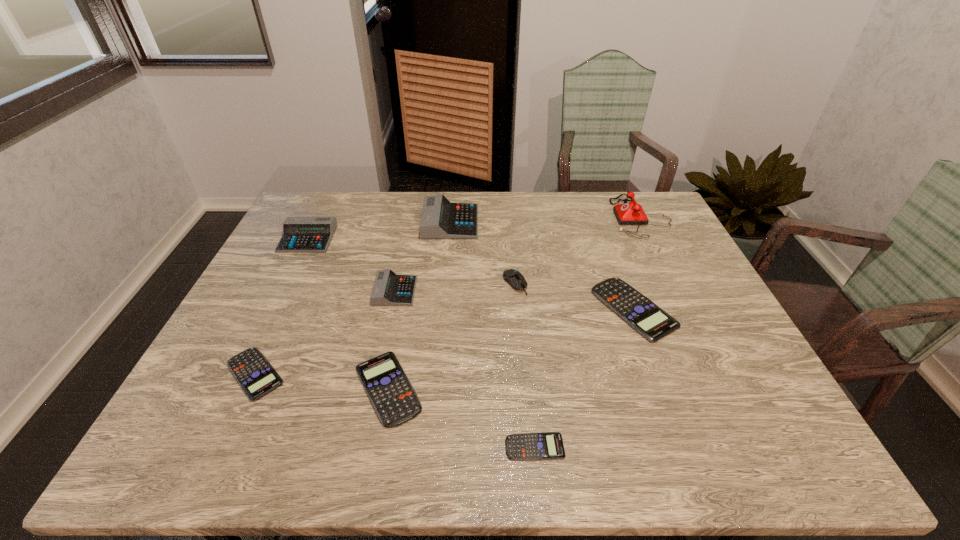
Find the location of `blank area located on the front of the biggest gray calculator`. blank area located on the front of the biggest gray calculator is located at coordinates (443, 308).

Find the location of a particular element. The height and width of the screenshot is (540, 960). vacant space located 0.120m on the back of the leftmost gray calculator is located at coordinates (324, 206).

You are a GUI agent. You are given a task and a screenshot of the screen. Output one action in this format:
    pyautogui.click(x=<x>, y=<y>)
    Task: Click on the vacant region located on the front of the nearest gray calculator
    
    Given the screenshot: What is the action you would take?
    pyautogui.click(x=380, y=359)

The image size is (960, 540). Find the location of `vacant space located 0.320m on the back of the computer mouse`. vacant space located 0.320m on the back of the computer mouse is located at coordinates (509, 212).

The height and width of the screenshot is (540, 960). I want to click on blank space located on the back of the biggest blue calculator, so click(x=612, y=247).

This screenshot has width=960, height=540. Identify the location of vacant space located 0.150m on the left of the second blue calculator from left to right. (284, 388).

Identify the location of vacant space located on the right of the third biggest blue calculator. (426, 374).

What are the coordinates of `vacant area located 0.100m on the right of the shortest object` in the screenshot? It's located at (613, 447).

Find the location of a particular element. The width and height of the screenshot is (960, 540). telephone located at the far edge is located at coordinates (632, 213).

You are a GUI agent. You are given a task and a screenshot of the screen. Output one action in this format:
    pyautogui.click(x=<x>, y=<y>)
    Task: Click on the telephone present at the right edge
    The image size is (960, 540).
    Given the screenshot: What is the action you would take?
    pyautogui.click(x=632, y=213)